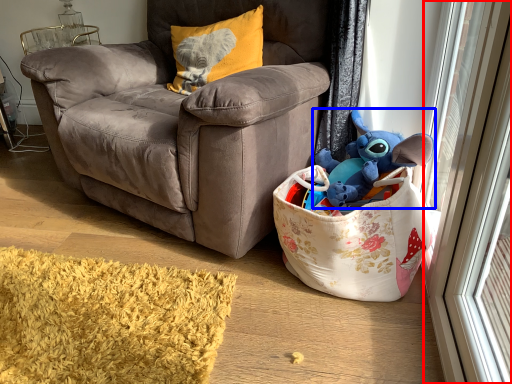
Question: Which object appears closest to the camera in this image, screen door (highlighted by a red box) or toy (highlighted by a blue box)?

Choices:
 (A) screen door
 (B) toy

Answer: (A)